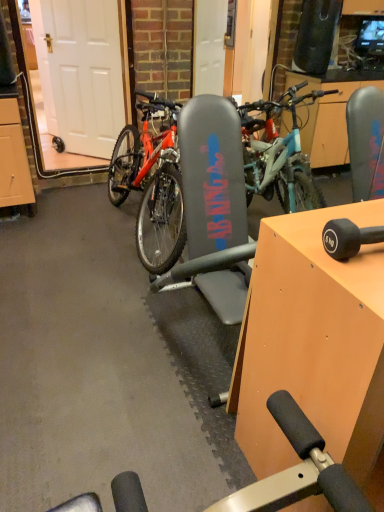
Question: Does matte black bicycle at center have a larger size compared to orange wood table at center?

Choices:
 (A) no
 (B) yes

Answer: (B)

Question: Is matte black bicycle at center located outside orange wood table at center?

Choices:
 (A) no
 (B) yes

Answer: (B)

Question: Is matte black bicycle at center positioned before orange wood table at center?

Choices:
 (A) yes
 (B) no

Answer: (B)

Question: Is matte black bicycle at center thinner than orange wood table at center?

Choices:
 (A) yes
 (B) no

Answer: (B)

Question: Is matte black bicycle at center surrounding orange wood table at center?

Choices:
 (A) yes
 (B) no

Answer: (B)

Question: From a real-world perspective, does matte black bicycle at center stand above orange wood table at center?

Choices:
 (A) no
 (B) yes

Answer: (B)

Question: From a real-world perspective, is orange wood table at center on top of white matte door at left?

Choices:
 (A) yes
 (B) no

Answer: (B)

Question: Does orange wood table at center turn towards white matte door at left?

Choices:
 (A) yes
 (B) no

Answer: (B)

Question: Is orange wood table at center facing away from white matte door at left?

Choices:
 (A) no
 (B) yes

Answer: (A)

Question: Can you confirm if orange wood table at center is wider than white matte door at left?

Choices:
 (A) no
 (B) yes

Answer: (B)

Question: Is orange wood table at center placed right next to white matte door at left?

Choices:
 (A) yes
 (B) no

Answer: (B)

Question: Can you confirm if orange wood table at center is smaller than white matte door at left?

Choices:
 (A) no
 (B) yes

Answer: (A)

Question: Considering the relative sizes of orange wood table at center and matte black bicycle at center in the image provided, is orange wood table at center bigger than matte black bicycle at center?

Choices:
 (A) no
 (B) yes

Answer: (A)